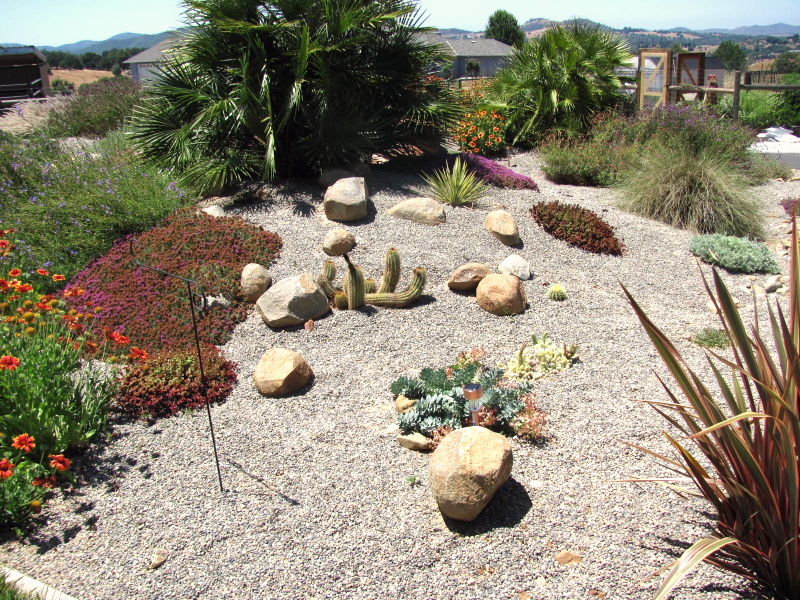
Identify the location of flag hanger. (190, 292).